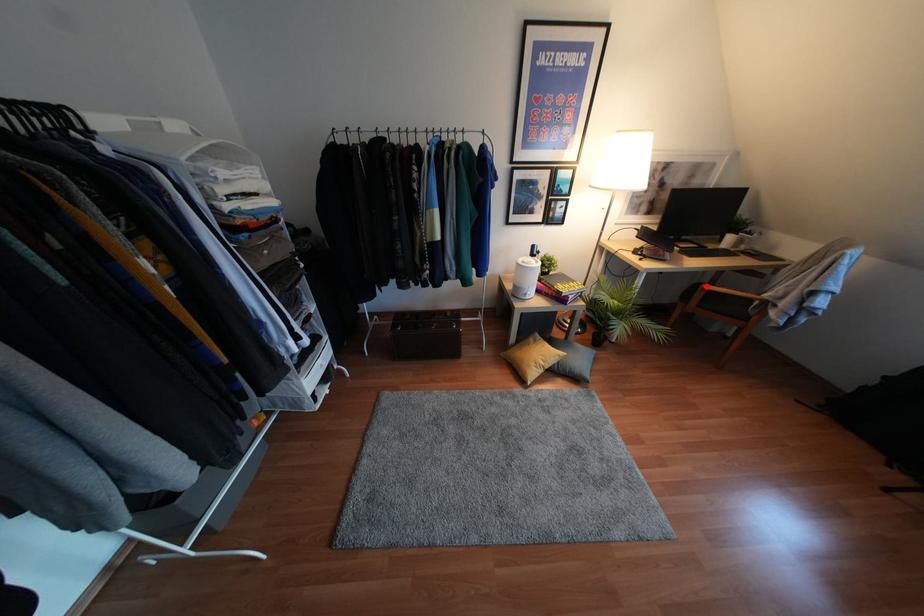
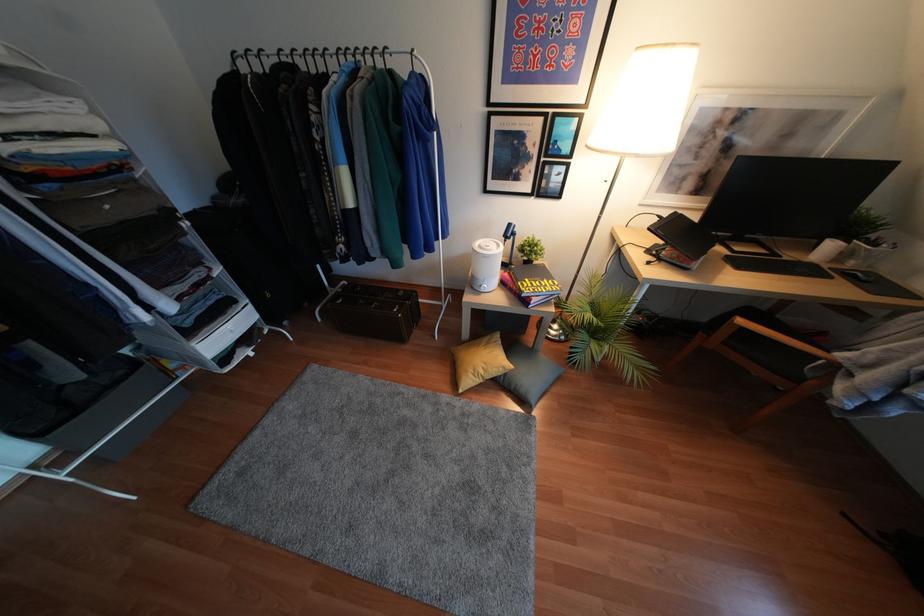
Locate, in the second image, the point that corresponds to the highlighted location in the first image.

(739, 321)